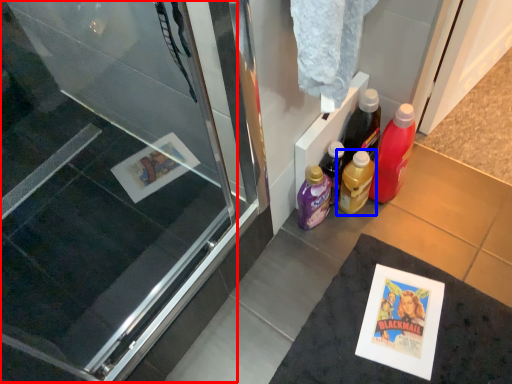
Question: Which of the following is the farthest to the observer, screen door (highlighted by a red box) or bottle (highlighted by a blue box)?

Choices:
 (A) screen door
 (B) bottle

Answer: (B)